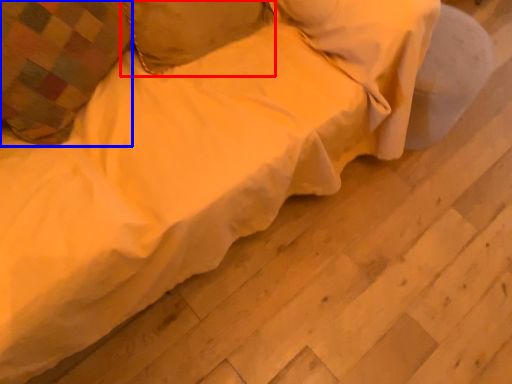
Question: Which point is further to the camera, pillow (highlighted by a red box) or pillow (highlighted by a blue box)?

Choices:
 (A) pillow
 (B) pillow

Answer: (A)